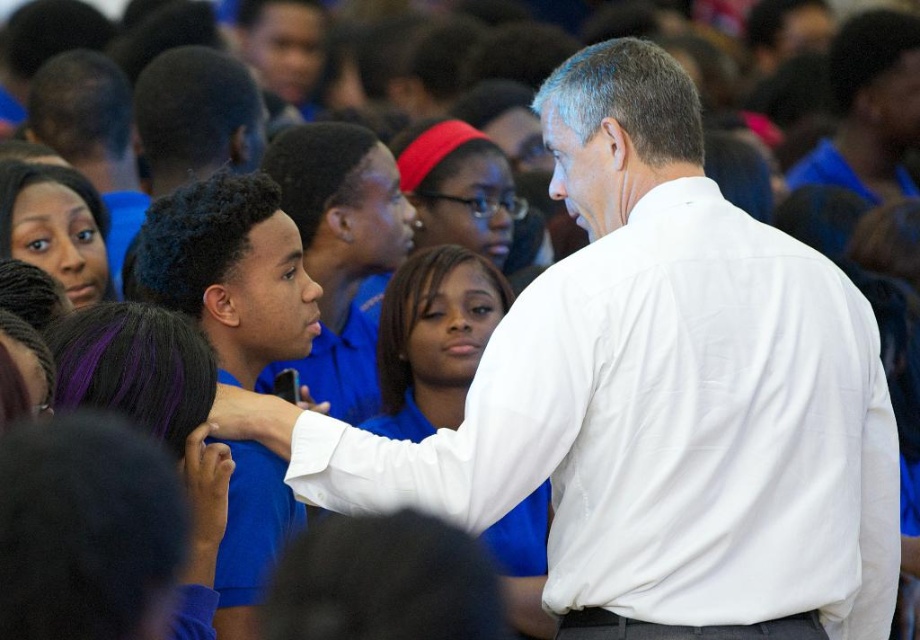
You are a photographer at the event and need to capture a photo where both the white smooth shirt at center and the blue shirt at center are visible. Based on their positions, which shirt should you focus on first to ensure both are in frame?

The white smooth shirt at center is below blue shirt at center, so you should focus on the blue shirt at center first to ensure both are in frame.

You are a photographer positioned at the center of the scene. You need to capture a photo that includes both the white smooth shirt at center and the blue shirt at center. The camera you are using has a focal length of 50mm and a field of view that can cover objects within a 5 feet radius. Will both subjects be in frame?

The white smooth shirt at center is 4.87 feet away from the blue shirt at center. Since the camera has a field of view covering up to 5 feet, both subjects will be within the frame as the distance between them is less than the maximum coverage.